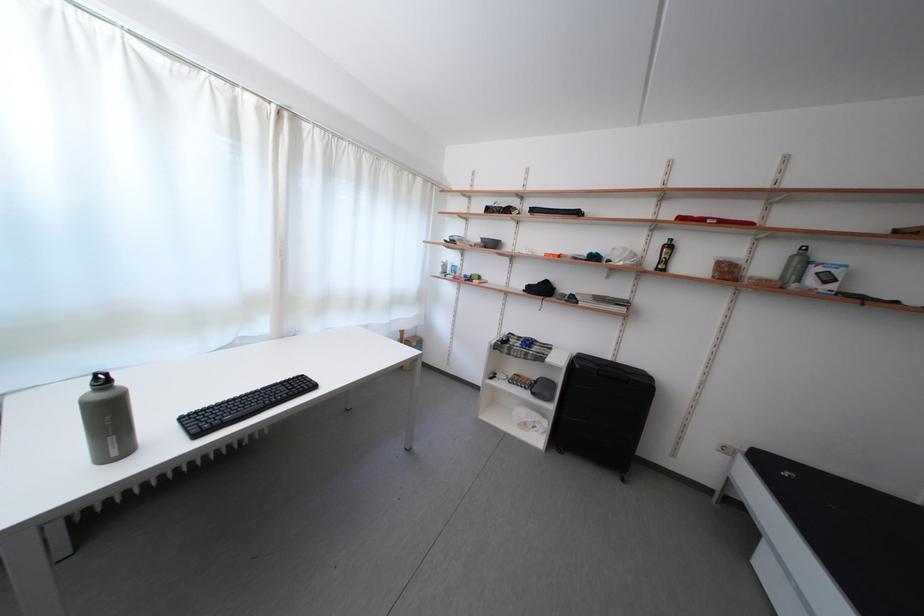
This screenshot has width=924, height=616. Identify the location of black suitcase handle. (612, 366).